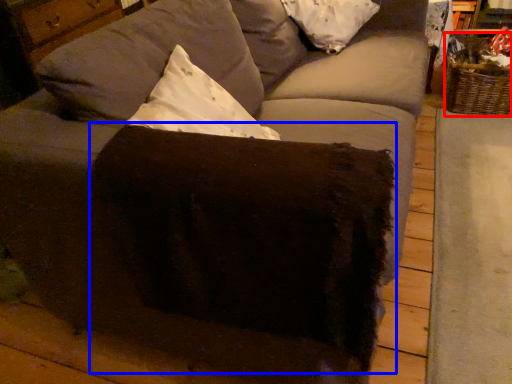
Question: Which object is further to the camera taking this photo, basket (highlighted by a red box) or swivel chair (highlighted by a blue box)?

Choices:
 (A) basket
 (B) swivel chair

Answer: (A)